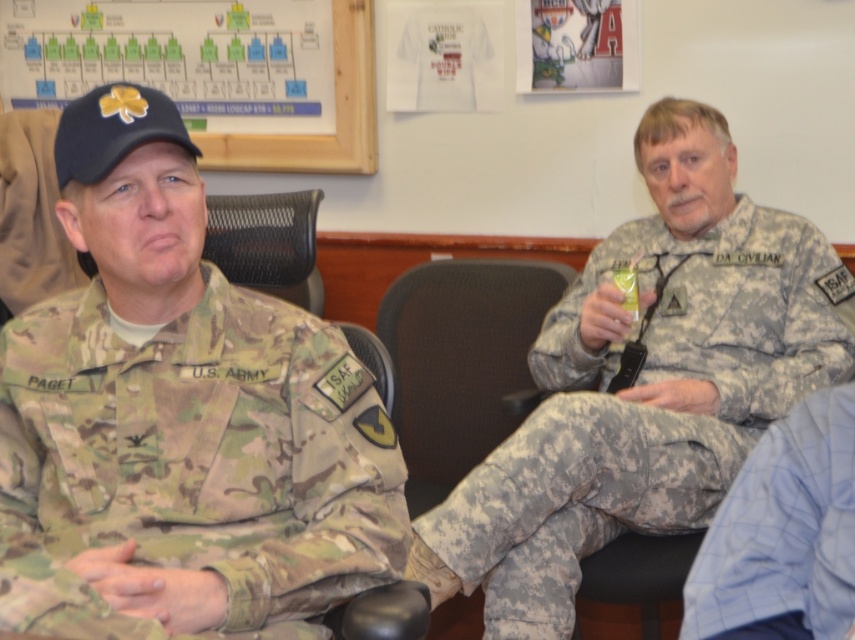
Is blue plaid shirt at lower right further to camera compared to wooden frame at upper left?

No, it is in front of wooden frame at upper left.

Is blue plaid shirt at lower right to the right of wooden frame at upper left from the viewer's perspective?

Yes, blue plaid shirt at lower right is to the right of wooden frame at upper left.

This screenshot has height=640, width=855. Describe the element at coordinates (783, 532) in the screenshot. I see `blue plaid shirt at lower right` at that location.

Find the location of a particular element. The height and width of the screenshot is (640, 855). blue plaid shirt at lower right is located at coordinates (783, 532).

Is point (146, 540) closer to viewer compared to point (335, 70)?

Yes, it is in front of point (335, 70).

Does point (42, 355) come farther from viewer compared to point (370, 145)?

No, (42, 355) is closer to viewer.

What are the coordinates of `camouflage uniform at left` in the screenshot? It's located at (180, 420).

Is camouflage uniform at left further to camera compared to blue plaid shirt at lower right?

Yes, it is.

Between camouflage uniform at left and blue plaid shirt at lower right, which one has more height?

camouflage uniform at left is taller.

This screenshot has height=640, width=855. What do you see at coordinates (180, 420) in the screenshot? I see `camouflage uniform at left` at bounding box center [180, 420].

Where is `camouflage uniform at left`? The width and height of the screenshot is (855, 640). camouflage uniform at left is located at coordinates (180, 420).